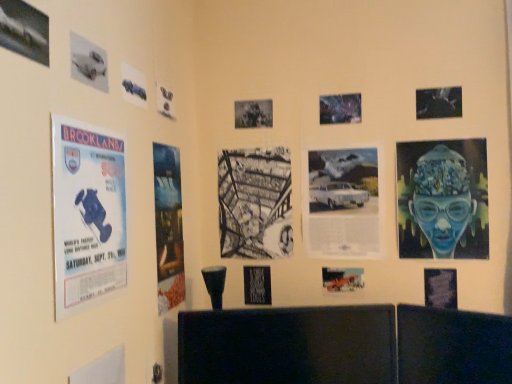
This screenshot has width=512, height=384. What do you see at coordinates (343, 202) in the screenshot?
I see `white paper at center, placed as the fourth poster when sorted from right to left` at bounding box center [343, 202].

What do you see at coordinates (255, 203) in the screenshot? The height and width of the screenshot is (384, 512). I see `black paper at center, acting as the eighth poster starting from the left` at bounding box center [255, 203].

The image size is (512, 384). What are the coordinates of `blue paper poster at left, marked as the third poster in a left-to-right arrangement` in the screenshot? It's located at (87, 213).

This screenshot has height=384, width=512. What are the coordinates of `metallic blue car at upper left, the fourth poster from the left` in the screenshot? It's located at (133, 85).

The width and height of the screenshot is (512, 384). What do you see at coordinates (443, 199) in the screenshot?
I see `blue glossy portrait at right, which is the fourteenth poster in left-to-right order` at bounding box center [443, 199].

The image size is (512, 384). I want to click on blue paper poster at left, the sixth poster when ordered from left to right, so click(x=168, y=227).

Can you tell me how much blue paper poster at left, arranged as the 12th poster when viewed from the right, and blue paper poster at left, which is the ninth poster in right-to-left order, differ in facing direction?

The angle between the facing direction of blue paper poster at left, arranged as the 12th poster when viewed from the right, and the facing direction of blue paper poster at left, which is the ninth poster in right-to-left order, is 0.0189 degrees.

Looking at their sizes, would you say blue paper poster at left, arranged as the 12th poster when viewed from the right, is wider or thinner than blue paper poster at left, which is the ninth poster in right-to-left order?

Clearly, blue paper poster at left, arranged as the 12th poster when viewed from the right, has more width compared to blue paper poster at left, which is the ninth poster in right-to-left order.

Is point (78, 289) farther from camera compared to point (158, 175)?

That is False.

Can you confirm if metallic blue car at upper left, the fourth poster from the left, is smaller than black glossy tv at lower center?

Indeed, metallic blue car at upper left, the fourth poster from the left, has a smaller size compared to black glossy tv at lower center.

Which of these two, metallic blue car at upper left, the eleventh poster in the right-to-left sequence, or black glossy tv at lower center, stands taller?

black glossy tv at lower center is taller.

Is metallic blue car at upper left, the eleventh poster in the right-to-left sequence, inside or outside of black glossy tv at lower center?

metallic blue car at upper left, the eleventh poster in the right-to-left sequence, cannot be found inside black glossy tv at lower center.

From the image's perspective, is metallic blue car at upper left, the eleventh poster in the right-to-left sequence, located above black glossy tv at lower center?

Yes, from the image's perspective, metallic blue car at upper left, the eleventh poster in the right-to-left sequence, is over black glossy tv at lower center.

Is black glossy tv at lower center oriented away from metallic blue car at upper left, the eleventh poster in the right-to-left sequence?

No, black glossy tv at lower center's orientation is not away from metallic blue car at upper left, the eleventh poster in the right-to-left sequence.

Where is `furniture on the right of the metallic blue car at upper left, the eleventh poster in the right-to-left sequence`? Image resolution: width=512 pixels, height=384 pixels. furniture on the right of the metallic blue car at upper left, the eleventh poster in the right-to-left sequence is located at coordinates (288, 346).

Considering the sizes of objects black glossy tv at lower center and metallic blue car at upper left, the fourth poster from the left, in the image provided, who is bigger, black glossy tv at lower center or metallic blue car at upper left, the fourth poster from the left,?

black glossy tv at lower center.

Considering the positions of point (229, 349) and point (128, 83), is point (229, 349) closer or farther from the camera than point (128, 83)?

Point (229, 349) is farther from the camera than point (128, 83).

Which object is positioned more to the left, metallic silver poster at upper right, which is the 3th poster from right to left, or metallic silver car at upper left, which is the 2th poster from left to right?

From the viewer's perspective, metallic silver car at upper left, which is the 2th poster from left to right, appears more on the left side.

Is metallic silver poster at upper right, which is the 3th poster from right to left, closer to camera compared to metallic silver car at upper left, which is the 2th poster from left to right?

No, the depth of metallic silver poster at upper right, which is the 3th poster from right to left, is greater than that of metallic silver car at upper left, which is the 2th poster from left to right.

Is metallic silver poster at upper right, which is the 3th poster from right to left, spatially inside metallic silver car at upper left, which is the 2th poster from left to right, or outside of it?

metallic silver poster at upper right, which is the 3th poster from right to left, is outside metallic silver car at upper left, which is the 2th poster from left to right.

Is blue paper poster at left, arranged as the 12th poster when viewed from the right, bigger or smaller than matte black poster at lower right, marked as the second poster in a right-to-left arrangement?

blue paper poster at left, arranged as the 12th poster when viewed from the right, is bigger than matte black poster at lower right, marked as the second poster in a right-to-left arrangement.

From the image's perspective, who appears lower, blue paper poster at left, marked as the third poster in a left-to-right arrangement, or matte black poster at lower right, marked as the second poster in a right-to-left arrangement?

matte black poster at lower right, marked as the second poster in a right-to-left arrangement, from the image's perspective.

From the matte black poster at lower right, marked as the second poster in a right-to-left arrangement, count 7th posters forward and point to it. Please provide its 2D coordinates.

[(87, 213)]

Is the surface of metallic silver poster at upper left, the first poster positioned from the left, in direct contact with blue paper poster at left, the sixth poster when ordered from left to right?

metallic silver poster at upper left, the first poster positioned from the left, is not next to blue paper poster at left, the sixth poster when ordered from left to right, and they're not touching.

Is blue paper poster at left, the sixth poster when ordered from left to right, surrounded by metallic silver poster at upper left, the first poster positioned from the left?

No, blue paper poster at left, the sixth poster when ordered from left to right, is not surrounded by metallic silver poster at upper left, the first poster positioned from the left.

Considering the sizes of objects metallic silver poster at upper left, which is counted as the fourteenth poster, starting from the right, and blue paper poster at left, the sixth poster when ordered from left to right, in the image provided, who is smaller, metallic silver poster at upper left, which is counted as the fourteenth poster, starting from the right, or blue paper poster at left, the sixth poster when ordered from left to right,?

metallic silver poster at upper left, which is counted as the fourteenth poster, starting from the right.

From the picture: Can you tell me how much metallic silver poster at upper left, which is counted as the fourteenth poster, starting from the right, and blue paper poster at left, which is the ninth poster in right-to-left order, differ in facing direction?

The angle between the facing direction of metallic silver poster at upper left, which is counted as the fourteenth poster, starting from the right, and the facing direction of blue paper poster at left, which is the ninth poster in right-to-left order, is 1.68 degrees.

From a real-world perspective, is metallic silver poster at upper left, which is counted as the fourteenth poster, starting from the right, positioned above or below blue paper poster at left, marked as the third poster in a left-to-right arrangement?

From a real-world perspective, metallic silver poster at upper left, which is counted as the fourteenth poster, starting from the right, is physically above blue paper poster at left, marked as the third poster in a left-to-right arrangement.

Considering the positions of objects metallic silver poster at upper left, which is counted as the fourteenth poster, starting from the right, and blue paper poster at left, marked as the third poster in a left-to-right arrangement, in the image provided, who is in front, metallic silver poster at upper left, which is counted as the fourteenth poster, starting from the right, or blue paper poster at left, marked as the third poster in a left-to-right arrangement,?

metallic silver poster at upper left, which is counted as the fourteenth poster, starting from the right, is closer to the camera.

Considering the relative sizes of metallic silver poster at upper left, which is counted as the fourteenth poster, starting from the right, and blue paper poster at left, marked as the third poster in a left-to-right arrangement, in the image provided, is metallic silver poster at upper left, which is counted as the fourteenth poster, starting from the right, shorter than blue paper poster at left, marked as the third poster in a left-to-right arrangement,?

Yes.

Is point (2, 17) closer to camera compared to point (82, 178)?

Yes, point (2, 17) is in front of point (82, 178).

From the blue paper poster at left, marked as the third poster in a left-to-right arrangement, count 3rd posters backward and point to it. Please provide its 2D coordinates.

[(168, 227)]

From the image's perspective, which poster is the 10th one above the black glossy tv at lower center? Please provide its 2D coordinates.

[(133, 85)]

From the image, which object appears to be nearer to metallic silver airplane at center, the fifth poster positioned from the right, black glossy tv at lower center or black paper at center, acting as the eighth poster starting from the right?

black glossy tv at lower center is closer to metallic silver airplane at center, the fifth poster positioned from the right.

Estimate the real-world distances between objects in this image. Which object is closer to metallic silver airplane at center, the fifth poster positioned from the right, metallic silver car at upper left, which is the thirteenth poster from right to left, or metallic silver poster at upper center, which is the sixth poster in right-to-left order?

metallic silver poster at upper center, which is the sixth poster in right-to-left order, is closer to metallic silver airplane at center, the fifth poster positioned from the right.

Considering their positions, is blue glossy portrait at right, which is the fourteenth poster in left-to-right order, positioned further to matte black poster at lower right, which ranks as the 13th poster in left-to-right order, than black paper at center, placed as the seventh poster when sorted from right to left?

Based on the image, black paper at center, placed as the seventh poster when sorted from right to left, appears to be further to matte black poster at lower right, which ranks as the 13th poster in left-to-right order.

Consider the image. Considering their positions, is blue paper poster at left, marked as the third poster in a left-to-right arrangement, positioned further to black paper at center, placed as the seventh poster when sorted from right to left, than metallic silver poster at upper left, which is counted as the fourteenth poster, starting from the right?

metallic silver poster at upper left, which is counted as the fourteenth poster, starting from the right, lies further to black paper at center, placed as the seventh poster when sorted from right to left, than the other object.

Based on their spatial positions, is blue paper poster at left, arranged as the 12th poster when viewed from the right, or metallic blue car at upper left, the eleventh poster in the right-to-left sequence, closer to metallic silver poster at upper center, which is the sixth poster in right-to-left order?

Based on the image, metallic blue car at upper left, the eleventh poster in the right-to-left sequence, appears to be nearer to metallic silver poster at upper center, which is the sixth poster in right-to-left order.

Considering their positions, is blue paper poster at left, marked as the third poster in a left-to-right arrangement, positioned closer to black glossy tv at lower center than black paper at center, acting as the eighth poster starting from the left?

The object closer to black glossy tv at lower center is black paper at center, acting as the eighth poster starting from the left.

Looking at the image, which one is located further to metallic silver car at upper left, which is the thirteenth poster from right to left, metallic silver poster at upper center, which is the 9th poster in left-to-right order, or matte black poster at lower right, which ranks as the 13th poster in left-to-right order?

matte black poster at lower right, which ranks as the 13th poster in left-to-right order, is positioned further to the anchor metallic silver car at upper left, which is the thirteenth poster from right to left.

From the picture: Looking at the image, which one is located further to blue paper poster at left, marked as the third poster in a left-to-right arrangement, blue paper poster at left, the sixth poster when ordered from left to right, or metallic blue car at upper left, the fourth poster from the left?

Among the two, metallic blue car at upper left, the fourth poster from the left, is located further to blue paper poster at left, marked as the third poster in a left-to-right arrangement.

Locate an element on the screen. furniture between metallic silver poster at upper left, which is counted as the fourteenth poster, starting from the right, and matte black poster at lower right, which ranks as the 13th poster in left-to-right order, from left to right is located at coordinates (288, 346).

Locate an element on the screen. The image size is (512, 384). furniture between blue paper poster at left, marked as the third poster in a left-to-right arrangement, and metallic silver airplane at center, the fifth poster positioned from the right, from left to right is located at coordinates (288, 346).

Identify the location of furniture between metallic silver poster at upper left, which is counted as the fourteenth poster, starting from the right, and blue glossy portrait at right, placed as the first poster when sorted from right to left. The height and width of the screenshot is (384, 512). (x=288, y=346).

You are a GUI agent. You are given a task and a screenshot of the screen. Output one action in this format:
    pyautogui.click(x=<x>, y=<y>)
    Task: Click on the furniture located between blue paper poster at left, which is the ninth poster in right-to-left order, and metallic silver airplane at center, the fifth poster positioned from the right, in the left-right direction
    
    Given the screenshot: What is the action you would take?
    pyautogui.click(x=288, y=346)